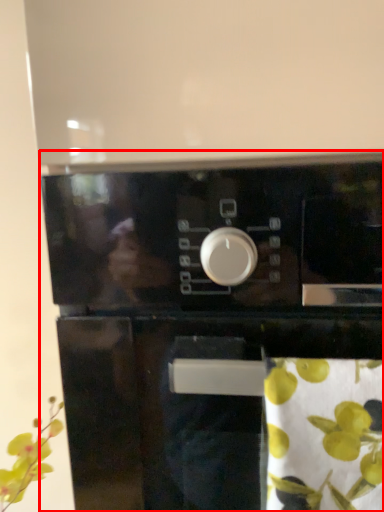
Question: From the image's perspective, what is the correct spatial relationship of home appliance (annotated by the red box) in relation to flower?

Choices:
 (A) below
 (B) above

Answer: (B)